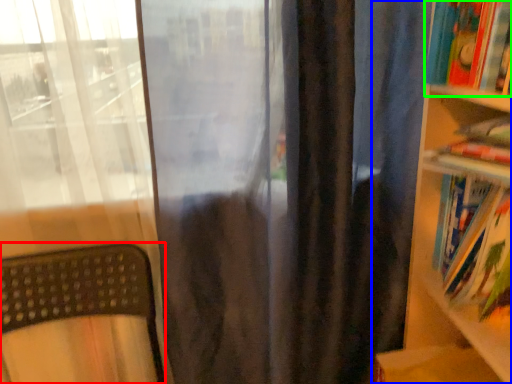
Question: Estimate the real-world distances between objects in this image. Which object is closer to furniture (highlighted by a red box), bookcase (highlighted by a blue box) or book (highlighted by a green box)?

Choices:
 (A) bookcase
 (B) book

Answer: (A)